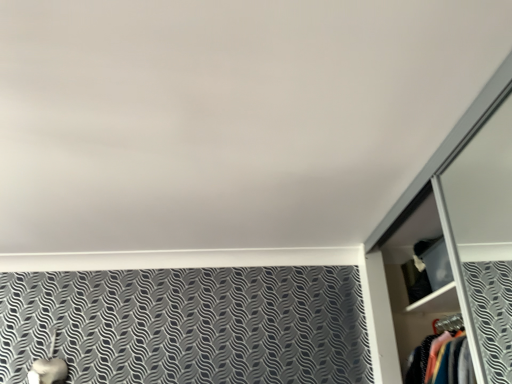
Question: Considering their positions, is matte black cabinet at upper right located in front of or behind metallic silver dresser at right?

Choices:
 (A) front
 (B) behind

Answer: (B)

Question: Is matte black cabinet at upper right to the left or to the right of metallic silver dresser at right in the image?

Choices:
 (A) right
 (B) left

Answer: (A)

Question: From a real-world perspective, is matte black cabinet at upper right above or below metallic silver dresser at right?

Choices:
 (A) above
 (B) below

Answer: (A)

Question: Looking at their shapes, would you say metallic silver dresser at right is wider or thinner than matte black cabinet at upper right?

Choices:
 (A) wide
 (B) thin

Answer: (A)

Question: Considering the positions of point (367, 243) and point (441, 283), is point (367, 243) closer or farther from the camera than point (441, 283)?

Choices:
 (A) farther
 (B) closer

Answer: (B)

Question: From their relative heights in the image, would you say metallic silver dresser at right is taller or shorter than matte black cabinet at upper right?

Choices:
 (A) tall
 (B) short

Answer: (A)

Question: Would you say metallic silver dresser at right is to the left or to the right of matte black cabinet at upper right in the picture?

Choices:
 (A) left
 (B) right

Answer: (A)